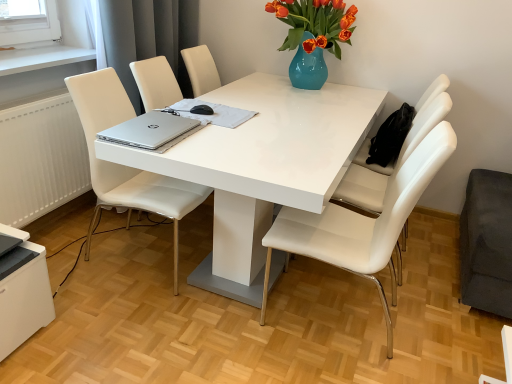
The height and width of the screenshot is (384, 512). I want to click on free space in front of white leather chair at center, which is the 1th chair from left to right, so click(133, 321).